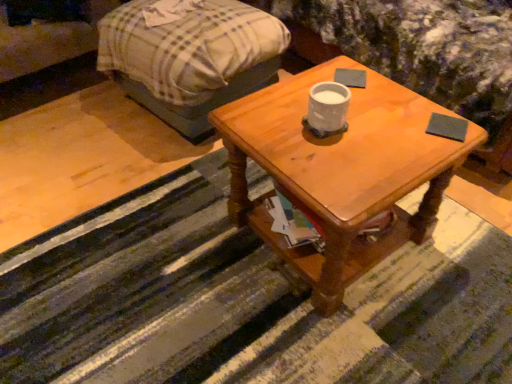
Where is `vacant space to the left of dark gray matte pad at upper center, which is counted as the 2th pad, starting from the front`? This screenshot has height=384, width=512. vacant space to the left of dark gray matte pad at upper center, which is counted as the 2th pad, starting from the front is located at coordinates (304, 85).